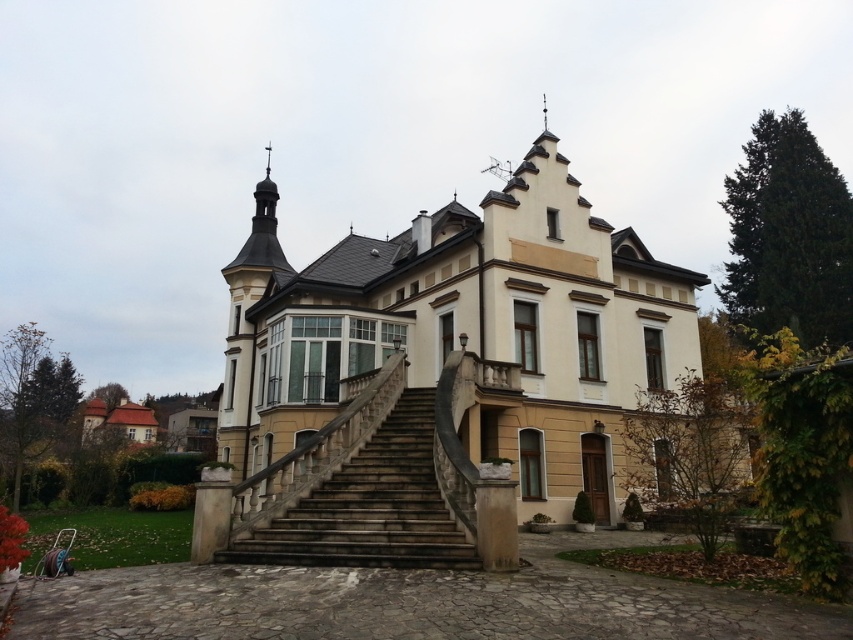
Is beige stone mansion at center behind brown shingles at lower left?

No, it is in front of brown shingles at lower left.

Describe the element at coordinates (453, 346) in the screenshot. I see `beige stone mansion at center` at that location.

This screenshot has width=853, height=640. What do you see at coordinates (453, 346) in the screenshot? I see `beige stone mansion at center` at bounding box center [453, 346].

The height and width of the screenshot is (640, 853). Find the location of `beige stone mansion at center`. beige stone mansion at center is located at coordinates (453, 346).

Who is positioned more to the right, beige stone mansion at center or brown stone staircase at center?

Positioned to the right is brown stone staircase at center.

Can you confirm if beige stone mansion at center is shorter than brown stone staircase at center?

Incorrect, beige stone mansion at center's height does not fall short of brown stone staircase at center's.

Which is in front, point (465, 301) or point (457, 544)?

Point (457, 544) is in front.

This screenshot has width=853, height=640. I want to click on beige stone mansion at center, so click(x=453, y=346).

Which is below, brown stone staircase at center or brown shingles at lower left?

brown shingles at lower left is below.

Is brown stone staircase at center to the left of brown shingles at lower left from the viewer's perspective?

Incorrect, brown stone staircase at center is not on the left side of brown shingles at lower left.

Which is behind, point (416, 532) or point (90, 416)?

Point (90, 416)

The height and width of the screenshot is (640, 853). I want to click on brown stone staircase at center, so click(x=370, y=506).